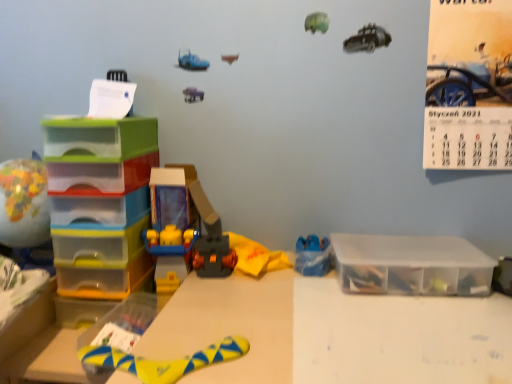
Question: Considering the relative positions of yellow paper calendar at upper right and translucent plastic drawers at left in the image provided, is yellow paper calendar at upper right to the left of translucent plastic drawers at left from the viewer's perspective?

Choices:
 (A) yes
 (B) no

Answer: (B)

Question: Is yellow paper calendar at upper right not within translucent plastic drawers at left?

Choices:
 (A) yes
 (B) no

Answer: (A)

Question: From a real-world perspective, does yellow paper calendar at upper right sit lower than translucent plastic drawers at left?

Choices:
 (A) yes
 (B) no

Answer: (B)

Question: Considering the relative sizes of yellow paper calendar at upper right and translucent plastic drawers at left in the image provided, is yellow paper calendar at upper right shorter than translucent plastic drawers at left?

Choices:
 (A) no
 (B) yes

Answer: (B)

Question: Is yellow paper calendar at upper right directly adjacent to translucent plastic drawers at left?

Choices:
 (A) yes
 (B) no

Answer: (B)

Question: Does point (371, 258) appear closer or farther from the camera than point (482, 39)?

Choices:
 (A) farther
 (B) closer

Answer: (B)

Question: Is clear plastic storage box at right inside or outside of yellow paper calendar at upper right?

Choices:
 (A) inside
 (B) outside

Answer: (B)

Question: In the image, is clear plastic storage box at right positioned in front of or behind yellow paper calendar at upper right?

Choices:
 (A) front
 (B) behind

Answer: (B)

Question: Based on their sizes in the image, would you say clear plastic storage box at right is bigger or smaller than yellow paper calendar at upper right?

Choices:
 (A) big
 (B) small

Answer: (B)

Question: From the image's perspective, is multicolored plastic globe at left, the 1th toy when ordered from left to right, positioned above or below clear plastic storage box at right?

Choices:
 (A) below
 (B) above

Answer: (B)

Question: Considering their positions, is multicolored plastic globe at left, the 1th toy when ordered from left to right, located in front of or behind clear plastic storage box at right?

Choices:
 (A) behind
 (B) front

Answer: (B)

Question: Would you say multicolored plastic globe at left, which ranks as the fourth toy in right-to-left order, is inside or outside clear plastic storage box at right?

Choices:
 (A) outside
 (B) inside

Answer: (A)

Question: Looking at the image, does multicolored plastic globe at left, the 1th toy when ordered from left to right, seem bigger or smaller compared to clear plastic storage box at right?

Choices:
 (A) small
 (B) big

Answer: (B)

Question: Relative to multicolored plastic globe at left, the 1th toy when ordered from left to right, is clear plastic storage box at right in front or behind?

Choices:
 (A) behind
 (B) front

Answer: (A)

Question: Considering the positions of clear plastic storage box at right and multicolored plastic globe at left, the 1th toy when ordered from left to right, in the image, is clear plastic storage box at right bigger or smaller than multicolored plastic globe at left, the 1th toy when ordered from left to right,?

Choices:
 (A) big
 (B) small

Answer: (B)